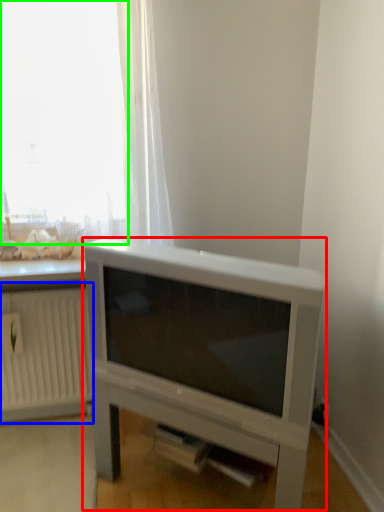
Question: Which object is the closest to the entertainment center (highlighted by a red box)? Choose among these: radiator (highlighted by a blue box) or window (highlighted by a green box).

Choices:
 (A) radiator
 (B) window

Answer: (A)